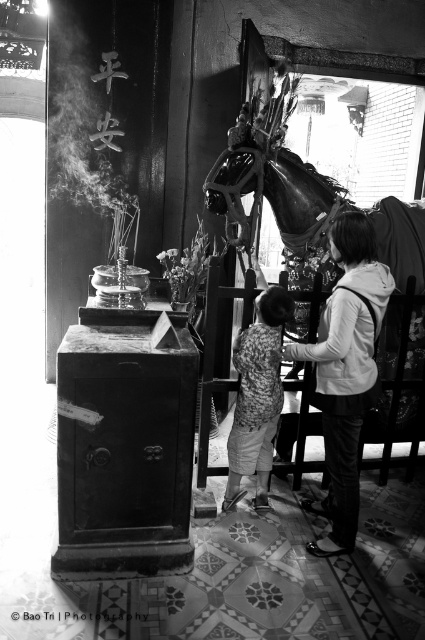
You are a visitor in this temple scene and notice two garments displayed at the center. The matte gray hoodie at center and the printed fabric shirt at center. Which garment is placed on top of the other?

The matte gray hoodie at center is positioned over the printed fabric shirt at center, so it is placed on top.